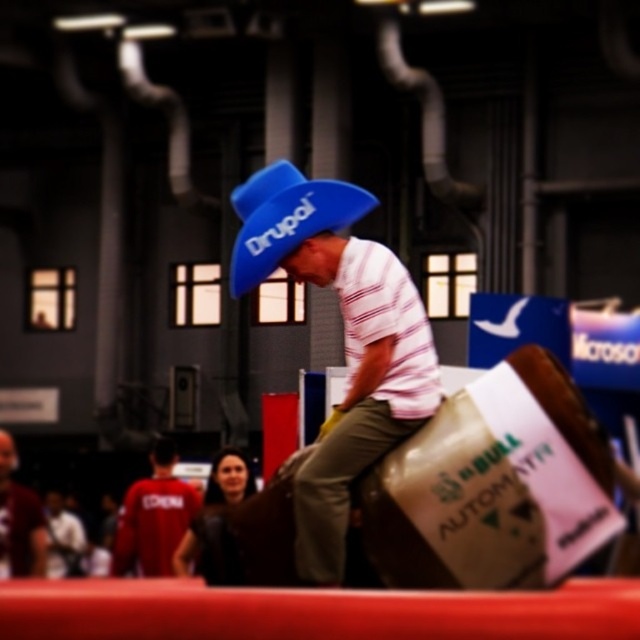
Question: Which point is farther to the camera?

Choices:
 (A) matte blue hat at center
 (B) matte red shirt at left
 (C) red fabric shirt at lower left

Answer: (C)

Question: Does red fabric shirt at lower left have a lesser width compared to matte red shirt at left?

Choices:
 (A) yes
 (B) no

Answer: (A)

Question: Which object is positioned farthest from the matte red shirt at left?

Choices:
 (A) matte blue hat at center
 (B) red fabric shirt at lower left

Answer: (A)

Question: Which is nearer to the matte red shirt at left?

Choices:
 (A) matte blue hat at center
 (B) red fabric shirt at lower left

Answer: (B)

Question: Does red fabric shirt at lower left appear on the right side of matte red shirt at left?

Choices:
 (A) no
 (B) yes

Answer: (B)

Question: Is red fabric shirt at lower left closer to the viewer compared to matte red shirt at left?

Choices:
 (A) no
 (B) yes

Answer: (A)